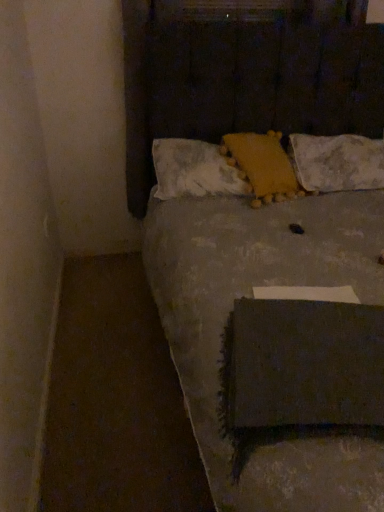
Question: Is yellow textured pillow at center, which ranks as the first pillow in left-to-right order, not inside textured gray bed at center?

Choices:
 (A) no
 (B) yes

Answer: (A)

Question: Could textured gray bed at center be considered to be inside yellow textured pillow at center, the third pillow when ordered from right to left?

Choices:
 (A) no
 (B) yes

Answer: (A)

Question: Is yellow textured pillow at center, the third pillow when ordered from right to left, oriented away from textured gray bed at center?

Choices:
 (A) yes
 (B) no

Answer: (A)

Question: From a real-world perspective, is yellow textured pillow at center, the third pillow when ordered from right to left, positioned under textured gray bed at center based on gravity?

Choices:
 (A) no
 (B) yes

Answer: (A)

Question: From the image's perspective, does yellow textured pillow at center, the third pillow when ordered from right to left, appear higher than textured gray bed at center?

Choices:
 (A) no
 (B) yes

Answer: (B)

Question: Is yellow textured pillow at center, which ranks as the first pillow in left-to-right order, further to camera compared to textured gray bed at center?

Choices:
 (A) yes
 (B) no

Answer: (A)

Question: Are yellow textured pillow at center, the third pillow when ordered from right to left, and white textured pillow at upper center, placed as the 3th pillow when sorted from left to right, located far from each other?

Choices:
 (A) yes
 (B) no

Answer: (B)

Question: Is yellow textured pillow at center, which ranks as the first pillow in left-to-right order, oriented towards white textured pillow at upper center, which is counted as the 1th pillow, starting from the right?

Choices:
 (A) yes
 (B) no

Answer: (B)

Question: Is yellow textured pillow at center, the third pillow when ordered from right to left, outside white textured pillow at upper center, placed as the 3th pillow when sorted from left to right?

Choices:
 (A) no
 (B) yes

Answer: (B)

Question: Is yellow textured pillow at center, which ranks as the first pillow in left-to-right order, looking in the opposite direction of white textured pillow at upper center, which is counted as the 1th pillow, starting from the right?

Choices:
 (A) yes
 (B) no

Answer: (B)

Question: Can you confirm if yellow textured pillow at center, the third pillow when ordered from right to left, is positioned to the left of white textured pillow at upper center, which is counted as the 1th pillow, starting from the right?

Choices:
 (A) yes
 (B) no

Answer: (A)

Question: Considering the relative sizes of yellow textured pillow at center, which ranks as the first pillow in left-to-right order, and white textured pillow at upper center, which is counted as the 1th pillow, starting from the right, in the image provided, is yellow textured pillow at center, which ranks as the first pillow in left-to-right order, taller than white textured pillow at upper center, which is counted as the 1th pillow, starting from the right,?

Choices:
 (A) no
 (B) yes

Answer: (A)

Question: Does textured gray bed at center have a larger size compared to yellow fuzzy pillow at center, which is the second pillow in right-to-left order?

Choices:
 (A) yes
 (B) no

Answer: (A)